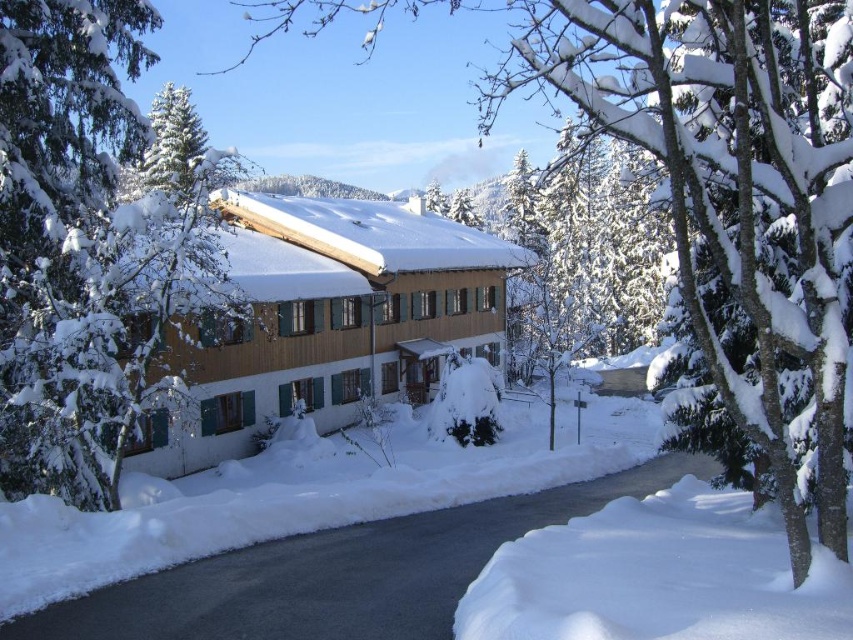
Question: Can you confirm if green matte tree at left is positioned to the left of white fluffy snow at lower right?

Choices:
 (A) yes
 (B) no

Answer: (A)

Question: Among these points, which one is farthest from the camera?

Choices:
 (A) pyautogui.click(x=572, y=616)
 (B) pyautogui.click(x=628, y=92)
 (C) pyautogui.click(x=215, y=262)

Answer: (C)

Question: Which of the following is the farthest from the observer?

Choices:
 (A) white fluffy snow at lower right
 (B) snow-covered tree at center
 (C) green matte tree at left

Answer: (C)

Question: Is snow-covered tree at center positioned at the back of white fluffy snow at lower right?

Choices:
 (A) no
 (B) yes

Answer: (B)

Question: Which point is farther to the camera?

Choices:
 (A) (532, 611)
 (B) (35, 353)
 (C) (781, 486)

Answer: (B)

Question: Can you confirm if green matte tree at left is thinner than white fluffy snow at lower right?

Choices:
 (A) no
 (B) yes

Answer: (A)